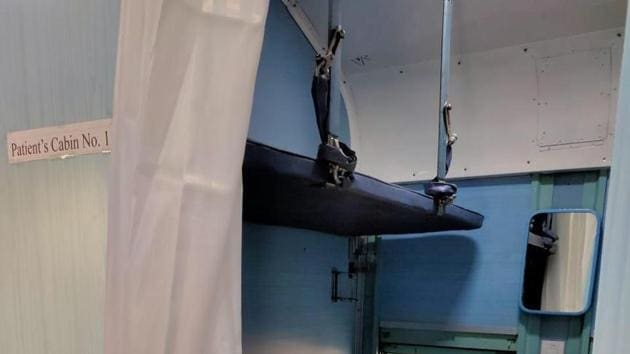
I want to click on shadow from hanging blue bed, so click(x=406, y=267).